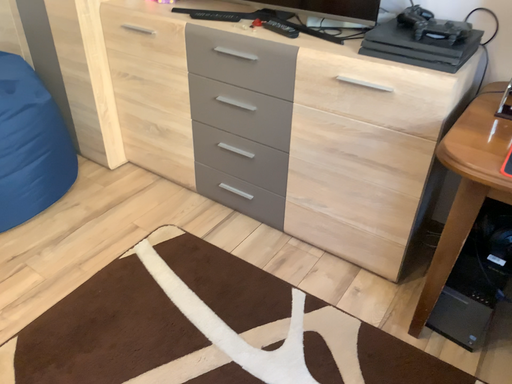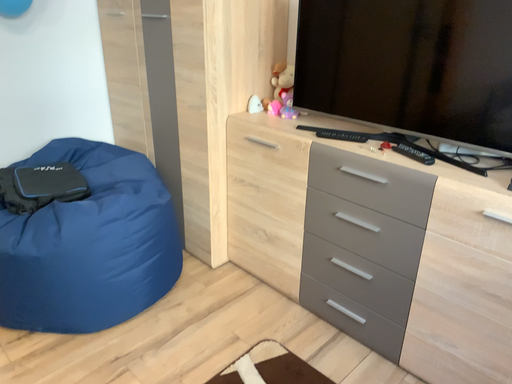
Question: How did the camera likely rotate when shooting the video?

Choices:
 (A) rotated left
 (B) rotated right

Answer: (A)